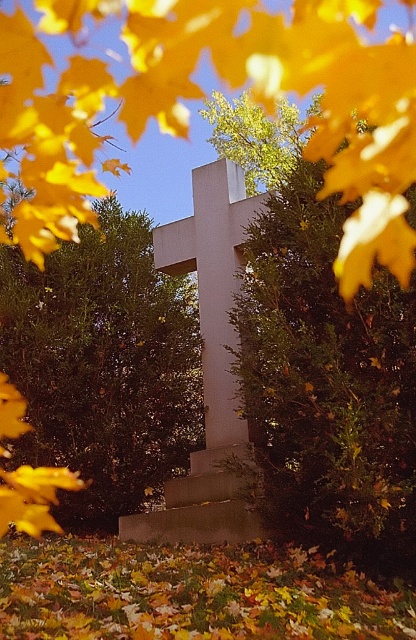
Question: Which object is farther from the camera taking this photo?

Choices:
 (A) white smooth cross at center
 (B) yellow matte leaf at upper center
 (C) green leafy tree at center

Answer: (B)

Question: Which of these objects is positioned closest to the green leafy bush at center?

Choices:
 (A) yellow matte leaf at upper center
 (B) green leafy tree at center
 (C) white smooth cross at center

Answer: (C)

Question: Which point is farther from the camera taking this photo?

Choices:
 (A) (235, 449)
 (B) (166, 92)

Answer: (B)

Question: Is green leafy bush at center closer to the viewer compared to white smooth cross at center?

Choices:
 (A) yes
 (B) no

Answer: (A)

Question: Can you confirm if green leafy bush at center is positioned to the right of green leafy tree at center?

Choices:
 (A) yes
 (B) no

Answer: (A)

Question: Can you confirm if yellow matte leaf at upper center is positioned below green leafy bush at center?

Choices:
 (A) no
 (B) yes

Answer: (A)